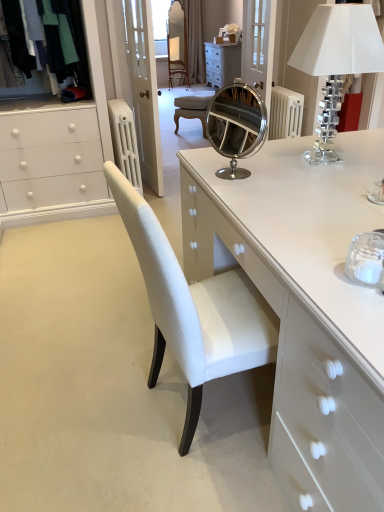
Question: Does white glossy chest of drawers at center have a larger size compared to clear glass door at upper center?

Choices:
 (A) no
 (B) yes

Answer: (B)

Question: Considering the relative positions of white glossy chest of drawers at center and clear glass door at upper center in the image provided, is white glossy chest of drawers at center behind clear glass door at upper center?

Choices:
 (A) no
 (B) yes

Answer: (A)

Question: Is white glossy chest of drawers at center far away from clear glass door at upper center?

Choices:
 (A) no
 (B) yes

Answer: (B)

Question: Are white glossy chest of drawers at center and clear glass door at upper center beside each other?

Choices:
 (A) no
 (B) yes

Answer: (A)

Question: Can you confirm if white glossy chest of drawers at center is wider than clear glass door at upper center?

Choices:
 (A) yes
 (B) no

Answer: (A)

Question: In the image, is white glossy chest of drawers at center positioned in front of or behind white painted metal radiator at upper left?

Choices:
 (A) behind
 (B) front

Answer: (B)

Question: From the image's perspective, is white glossy chest of drawers at center located above or below white painted metal radiator at upper left?

Choices:
 (A) above
 (B) below

Answer: (B)

Question: Based on their sizes in the image, would you say white glossy chest of drawers at center is bigger or smaller than white painted metal radiator at upper left?

Choices:
 (A) big
 (B) small

Answer: (A)

Question: Is white glossy chest of drawers at center wider or thinner than white painted metal radiator at upper left?

Choices:
 (A) wide
 (B) thin

Answer: (A)

Question: Choose the correct answer: Is clear crystal lampshade at upper right inside white painted metal radiator at upper left or outside it?

Choices:
 (A) outside
 (B) inside

Answer: (A)

Question: From the image's perspective, is clear crystal lampshade at upper right positioned above or below white painted metal radiator at upper left?

Choices:
 (A) above
 (B) below

Answer: (B)

Question: Based on their sizes in the image, would you say clear crystal lampshade at upper right is bigger or smaller than white painted metal radiator at upper left?

Choices:
 (A) big
 (B) small

Answer: (B)

Question: From a real-world perspective, is clear crystal lampshade at upper right above or below white painted metal radiator at upper left?

Choices:
 (A) above
 (B) below

Answer: (A)

Question: Is white glossy chest of drawers at center bigger or smaller than clear crystal lampshade at upper right?

Choices:
 (A) small
 (B) big

Answer: (B)

Question: Considering the relative positions of white glossy chest of drawers at center and clear crystal lampshade at upper right in the image provided, is white glossy chest of drawers at center to the left or to the right of clear crystal lampshade at upper right?

Choices:
 (A) left
 (B) right

Answer: (A)